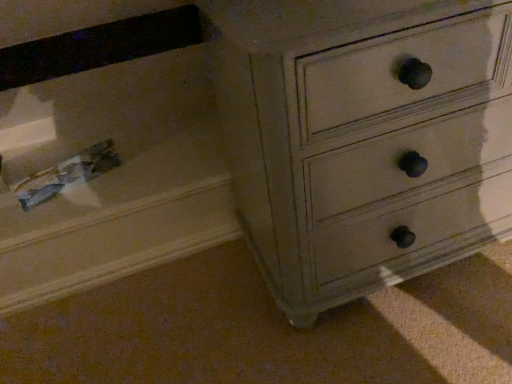
Question: Which direction should I rotate to look at matte white drawer at center, which is the 1th drawer in right-to-left order?

Choices:
 (A) left
 (B) right

Answer: (B)

Question: Is matte white drawer at center, which is the 1th drawer in right-to-left order, completely or partially outside of clear plastic drawer at lower left, the first drawer when ordered from left to right?

Choices:
 (A) no
 (B) yes

Answer: (B)

Question: Is matte white drawer at center, which is the 1th drawer in right-to-left order, oriented away from clear plastic drawer at lower left, the first drawer when ordered from left to right?

Choices:
 (A) no
 (B) yes

Answer: (A)

Question: From the image's perspective, is matte white drawer at center, which is the 1th drawer in right-to-left order, located beneath clear plastic drawer at lower left, marked as the second drawer in a right-to-left arrangement?

Choices:
 (A) yes
 (B) no

Answer: (B)

Question: Is the surface of matte white drawer at center, which is the 1th drawer in right-to-left order, in direct contact with clear plastic drawer at lower left, marked as the second drawer in a right-to-left arrangement?

Choices:
 (A) yes
 (B) no

Answer: (B)

Question: Does matte white drawer at center, which is the 1th drawer in right-to-left order, come behind clear plastic drawer at lower left, marked as the second drawer in a right-to-left arrangement?

Choices:
 (A) no
 (B) yes

Answer: (A)

Question: Considering the relative sizes of matte white drawer at center, the 2th drawer from the left, and clear plastic drawer at lower left, marked as the second drawer in a right-to-left arrangement, in the image provided, is matte white drawer at center, the 2th drawer from the left, bigger than clear plastic drawer at lower left, marked as the second drawer in a right-to-left arrangement,?

Choices:
 (A) yes
 (B) no

Answer: (A)

Question: Considering the relative sizes of clear plastic drawer at lower left, marked as the second drawer in a right-to-left arrangement, and matte white drawer at center, which is the 1th drawer in right-to-left order, in the image provided, is clear plastic drawer at lower left, marked as the second drawer in a right-to-left arrangement, wider than matte white drawer at center, which is the 1th drawer in right-to-left order,?

Choices:
 (A) yes
 (B) no

Answer: (A)

Question: Could matte white drawer at center, the 2th drawer from the left, be considered to be inside clear plastic drawer at lower left, marked as the second drawer in a right-to-left arrangement?

Choices:
 (A) no
 (B) yes

Answer: (A)

Question: Is clear plastic drawer at lower left, marked as the second drawer in a right-to-left arrangement, taller than matte white drawer at center, the 2th drawer from the left?

Choices:
 (A) yes
 (B) no

Answer: (B)

Question: From the image's perspective, is clear plastic drawer at lower left, marked as the second drawer in a right-to-left arrangement, on top of matte white drawer at center, the 2th drawer from the left?

Choices:
 (A) yes
 (B) no

Answer: (B)

Question: Is clear plastic drawer at lower left, marked as the second drawer in a right-to-left arrangement, closer to camera compared to matte white drawer at center, which is the 1th drawer in right-to-left order?

Choices:
 (A) no
 (B) yes

Answer: (A)

Question: Is there a large distance between clear plastic drawer at lower left, marked as the second drawer in a right-to-left arrangement, and matte white drawer at center, which is the 1th drawer in right-to-left order?

Choices:
 (A) yes
 (B) no

Answer: (B)

Question: Relative to clear plastic drawer at lower left, marked as the second drawer in a right-to-left arrangement, is matte white drawer at center, the 2th drawer from the left, in front or behind?

Choices:
 (A) front
 (B) behind

Answer: (A)